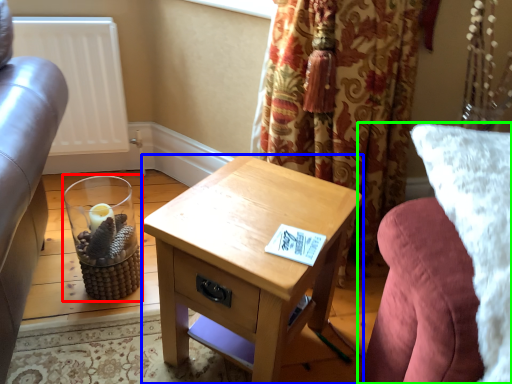
Question: Which object is positioned closest to candle holder (highlighted by a red box)? Select from nightstand (highlighted by a blue box) and studio couch (highlighted by a green box).

Choices:
 (A) nightstand
 (B) studio couch

Answer: (A)